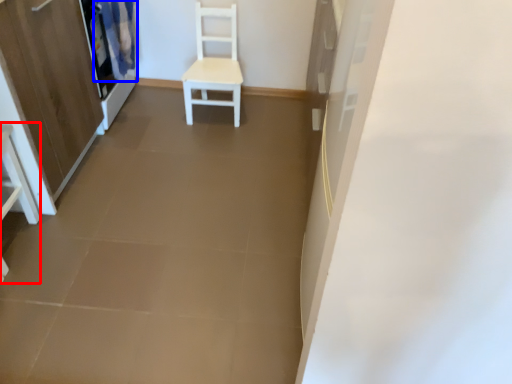
Question: Which point is closer to the camera, vanity (highlighted by a red box) or curtain (highlighted by a blue box)?

Choices:
 (A) vanity
 (B) curtain

Answer: (A)